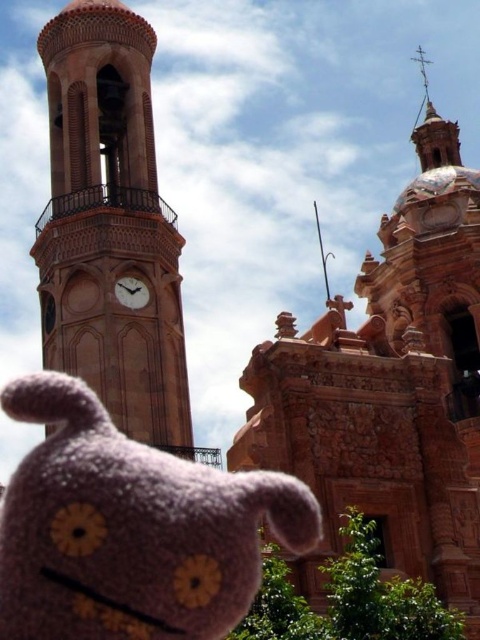
Question: Which point appears farthest from the camera in this image?

Choices:
 (A) (153, 269)
 (B) (143, 289)
 (C) (80, 550)
 (D) (478, 584)

Answer: (A)

Question: Is purple fuzzy toy at lower left thinner than brown stone clock tower at left?

Choices:
 (A) yes
 (B) no

Answer: (B)

Question: Is brown stone clock tower at left to the left of matte brown clock at center-left from the viewer's perspective?

Choices:
 (A) yes
 (B) no

Answer: (A)

Question: Among these points, which one is nearest to the camera?

Choices:
 (A) (396, 410)
 (B) (134, 280)
 (C) (105, 188)

Answer: (A)

Question: Which of the following is the farthest from the observer?

Choices:
 (A) (63, 276)
 (B) (368, 401)
 (C) (206, 506)
 (D) (130, 301)

Answer: (A)

Question: Does terracotta stone church at upper center lie in front of matte brown clock at center-left?

Choices:
 (A) no
 (B) yes

Answer: (B)